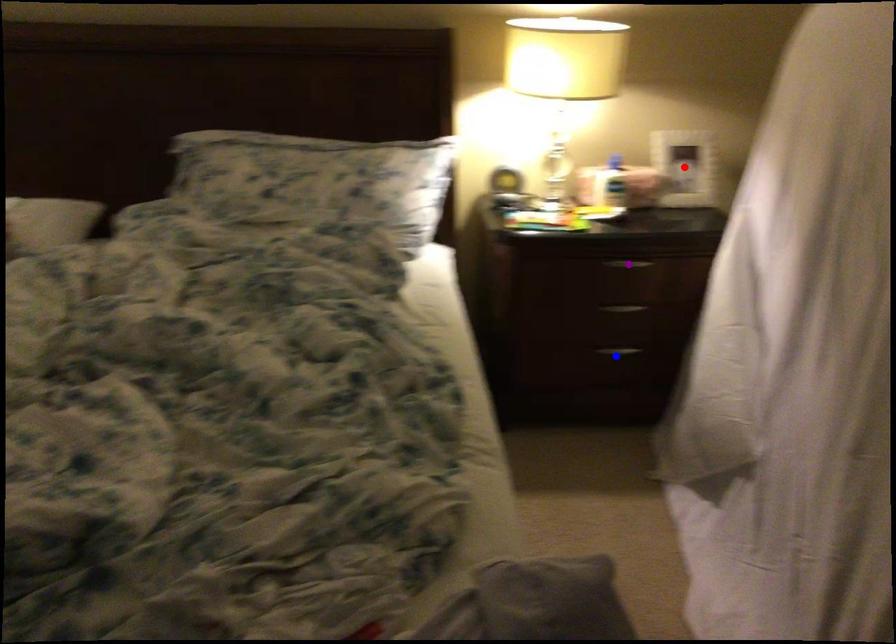
Order these from nearest to farthest:
- purple point
- blue point
- red point

1. purple point
2. blue point
3. red point